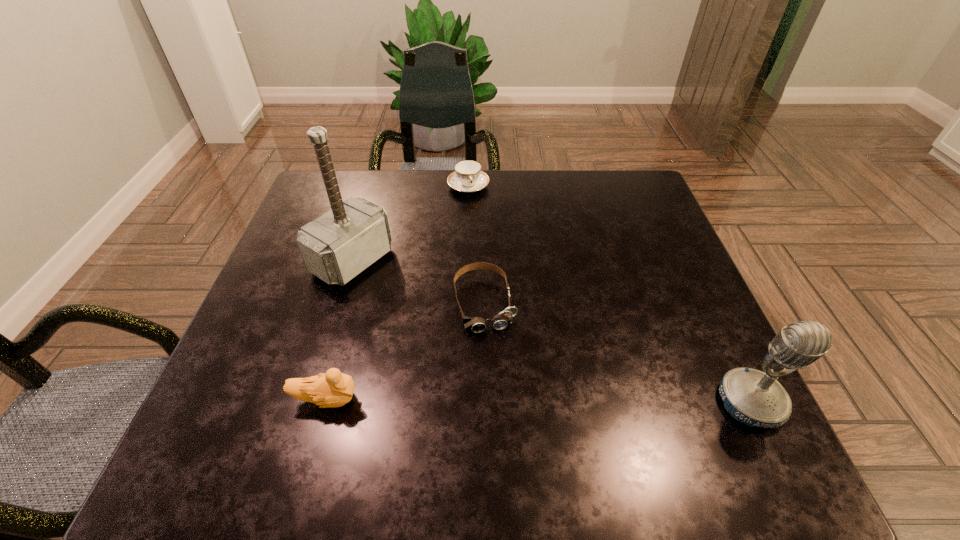
The width and height of the screenshot is (960, 540). What are the coordinates of `vacant space on the desktop that is between the third shortest object and the fourth shortest object and is positioned for striking with the head of the tallest object` in the screenshot? It's located at (588, 401).

Locate an element on the screen. The image size is (960, 540). free spot on the desktop that is between the duckling and the rightmost object and is positioned on the front-facing side of the goggles is located at coordinates (507, 400).

At what (x,y) coordinates should I click in order to perform the action: click on vacant space on the desktop that is between the duckling and the rightmost object and is positioned on the side with the handle of the teacup. Please return your answer as a coordinate pair (x, y). The image size is (960, 540). Looking at the image, I should click on (538, 401).